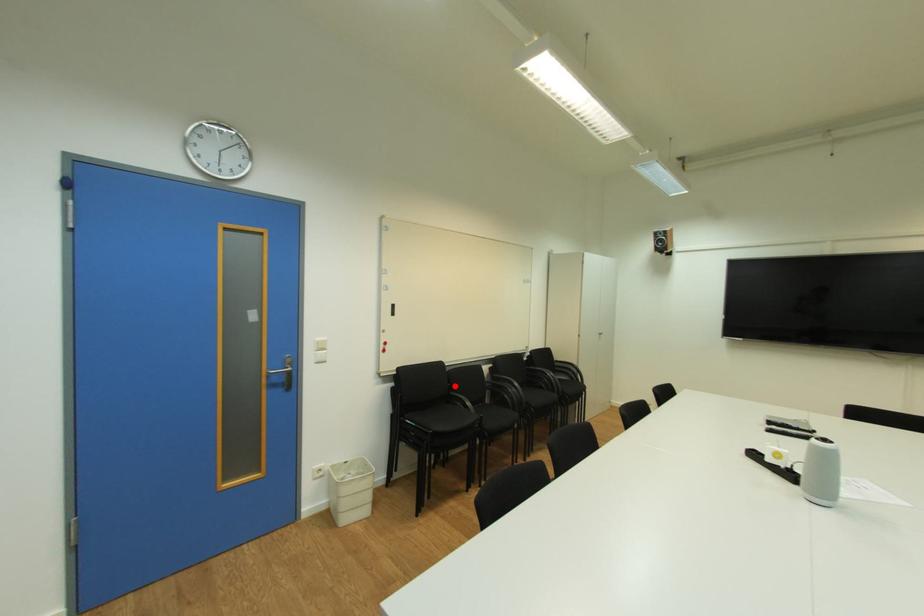
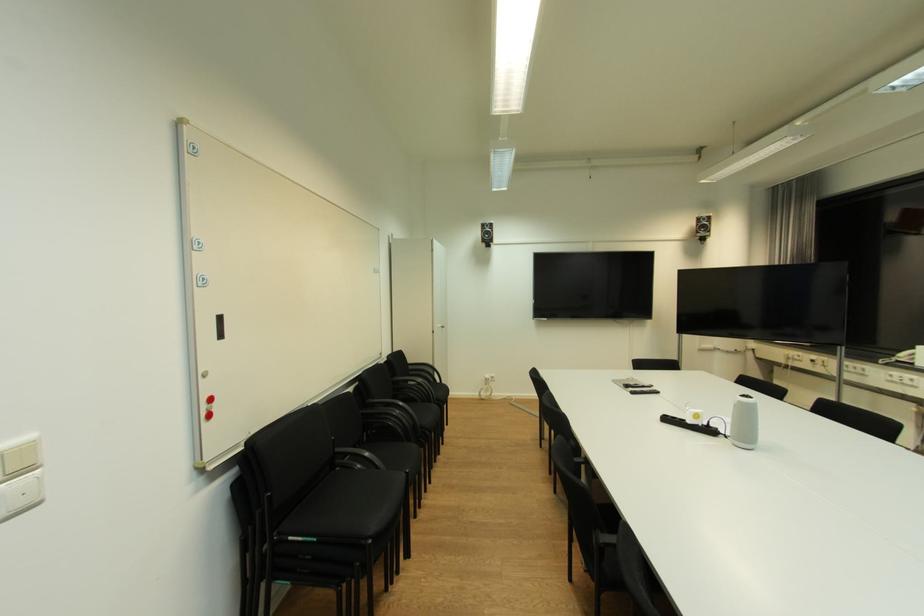
Question: I am providing you with two images of the same scene from different viewpoints. Given a red point in image1, look at the same physical point in image2. Is it:

Choices:
 (A) Closer to the viewpoint
 (B) Farther from the viewpoint

Answer: (A)